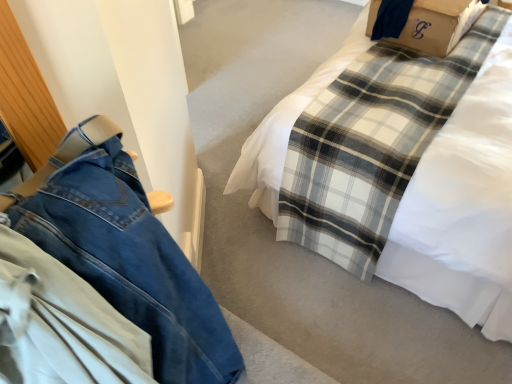
Describe the element at coordinates (438, 25) in the screenshot. The height and width of the screenshot is (384, 512). I see `brown cardboard box at upper right` at that location.

The width and height of the screenshot is (512, 384). Identify the location of denim pants at left. (131, 263).

Locate an element on the screen. The image size is (512, 384). white plaid blanket at center is located at coordinates (463, 208).

Is brown cardboard box at upper right smaller than white plaid blanket at center?

Yes.

Does brown cardboard box at upper right touch white plaid blanket at center?

No, brown cardboard box at upper right is not beside white plaid blanket at center.

From the image's perspective, is brown cardboard box at upper right above or below white plaid blanket at center?

brown cardboard box at upper right is above white plaid blanket at center.

How many degrees apart are the facing directions of brown cardboard box at upper right and white plaid blanket at center?

The facing directions of brown cardboard box at upper right and white plaid blanket at center are 3.27 degrees apart.

Is denim pants at left facing away from brown cardboard box at upper right?

That's not correct — denim pants at left is not looking away from brown cardboard box at upper right.

Does point (200, 316) come farther from viewer compared to point (456, 15)?

No, it is not.

In the image, is denim pants at left positioned in front of or behind brown cardboard box at upper right?

Clearly, denim pants at left is in front of brown cardboard box at upper right.

From a real-world perspective, is denim pants at left on brown cardboard box at upper right?

Yes, from a real-world perspective, denim pants at left is on top of brown cardboard box at upper right.

Which object is further away from the camera, brown cardboard box at upper right or denim pants at left?

Positioned behind is brown cardboard box at upper right.

How much distance is there between brown cardboard box at upper right and denim pants at left?

The distance of brown cardboard box at upper right from denim pants at left is 1.65 meters.

From the image's perspective, is brown cardboard box at upper right below denim pants at left?

Actually, brown cardboard box at upper right appears above denim pants at left in the image.

How different are the orientations of brown cardboard box at upper right and denim pants at left in degrees?

178 degrees separate the facing orientations of brown cardboard box at upper right and denim pants at left.

How different are the orientations of denim pants at left and white plaid blanket at center in degrees?

178 degrees.

Does denim pants at left have a lesser height compared to white plaid blanket at center?

Yes, denim pants at left is shorter than white plaid blanket at center.

Choose the correct answer: Is denim pants at left inside white plaid blanket at center or outside it?

denim pants at left cannot be found inside white plaid blanket at center.

From the image's perspective, which object appears higher, denim pants at left or white plaid blanket at center?

white plaid blanket at center is shown above in the image.

From the image's perspective, between white plaid blanket at center and denim pants at left, which one is located above?

white plaid blanket at center.

From a real-world perspective, is white plaid blanket at center above or below denim pants at left?

In terms of real-world spatial position, white plaid blanket at center is below denim pants at left.

Considering the sizes of objects white plaid blanket at center and denim pants at left in the image provided, who is wider, white plaid blanket at center or denim pants at left?

With larger width is white plaid blanket at center.

From the picture: Considering the sizes of objects white plaid blanket at center and denim pants at left in the image provided, who is bigger, white plaid blanket at center or denim pants at left?

white plaid blanket at center is bigger.

From a real-world perspective, is white plaid blanket at center positioned above or below brown cardboard box at upper right?

white plaid blanket at center is below brown cardboard box at upper right.

In terms of width, does white plaid blanket at center look wider or thinner when compared to brown cardboard box at upper right?

white plaid blanket at center is wider than brown cardboard box at upper right.

This screenshot has width=512, height=384. Find the location of `bed below the brown cardboard box at upper right (from the image's perspective)`. bed below the brown cardboard box at upper right (from the image's perspective) is located at coordinates (463, 208).

What are the coordinates of `bed located underneath the brown cardboard box at upper right (from a real-world perspective)` in the screenshot? It's located at click(463, 208).

Where is `trousers below the brown cardboard box at upper right (from the image's perspective)`? trousers below the brown cardboard box at upper right (from the image's perspective) is located at coordinates (131, 263).

Which object lies further to the anchor point denim pants at left, white plaid blanket at center or brown cardboard box at upper right?

Based on the image, brown cardboard box at upper right appears to be further to denim pants at left.

Based on the photo, considering their positions, is white plaid blanket at center positioned closer to brown cardboard box at upper right than denim pants at left?

white plaid blanket at center.

Which object lies further to the anchor point white plaid blanket at center, brown cardboard box at upper right or denim pants at left?

Based on the image, denim pants at left appears to be further to white plaid blanket at center.

Looking at the image, which one is located closer to brown cardboard box at upper right, denim pants at left or white plaid blanket at center?

The object closer to brown cardboard box at upper right is white plaid blanket at center.

Looking at the image, which one is located closer to denim pants at left, brown cardboard box at upper right or white plaid blanket at center?

white plaid blanket at center is positioned closer to the anchor denim pants at left.

In the scene shown: Based on their spatial positions, is denim pants at left or brown cardboard box at upper right closer to white plaid blanket at center?

brown cardboard box at upper right.

I want to click on bed between denim pants at left and brown cardboard box at upper right in the front-back direction, so 463,208.